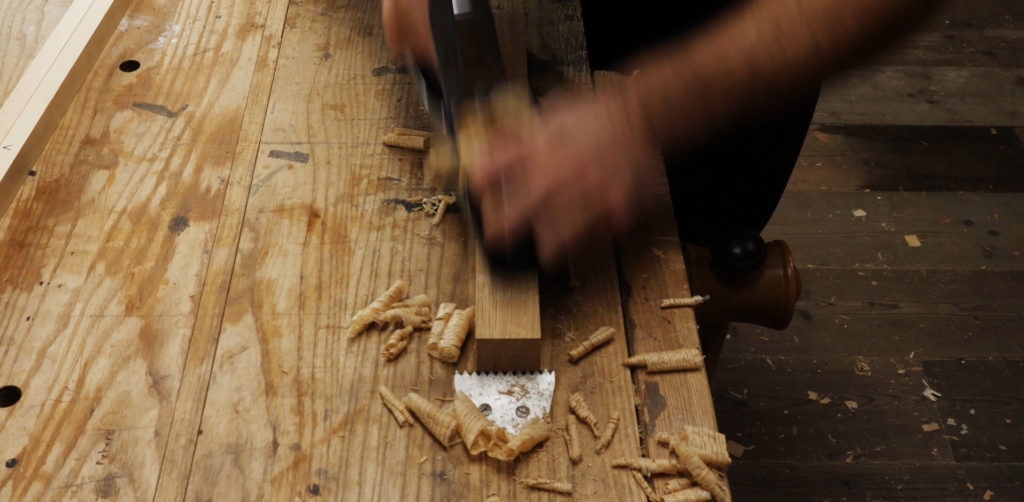
Where is `wooden table`? The width and height of the screenshot is (1024, 502). wooden table is located at coordinates (109, 229), (254, 247).